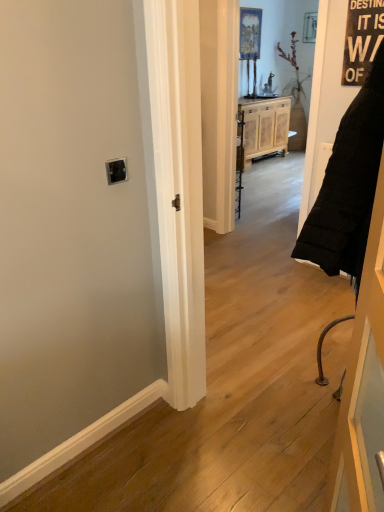
Question: Is black fabric door at right smaller than light brown wood cabinet at center?

Choices:
 (A) no
 (B) yes

Answer: (B)

Question: From a real-world perspective, is black fabric door at right located higher than light brown wood cabinet at center?

Choices:
 (A) yes
 (B) no

Answer: (A)

Question: Is light brown wood cabinet at center at the back of black fabric door at right?

Choices:
 (A) no
 (B) yes

Answer: (A)

Question: Is light brown wood cabinet at center inside black fabric door at right?

Choices:
 (A) yes
 (B) no

Answer: (B)

Question: Does black fabric door at right appear on the left side of light brown wood cabinet at center?

Choices:
 (A) no
 (B) yes

Answer: (B)

Question: Are black fabric door at right and light brown wood cabinet at center far apart?

Choices:
 (A) no
 (B) yes

Answer: (B)

Question: Does light brown wood cabinet at center come behind black fabric door at right?

Choices:
 (A) no
 (B) yes

Answer: (B)

Question: Does light brown wood cabinet at center have a lesser height compared to black fabric door at right?

Choices:
 (A) yes
 (B) no

Answer: (A)

Question: Could you tell me if light brown wood cabinet at center is facing black fabric door at right?

Choices:
 (A) no
 (B) yes

Answer: (B)

Question: Is light brown wood cabinet at center positioned far away from black fabric door at right?

Choices:
 (A) no
 (B) yes

Answer: (B)

Question: Does light brown wood cabinet at center have a lesser width compared to black fabric door at right?

Choices:
 (A) yes
 (B) no

Answer: (B)

Question: From a real-world perspective, is light brown wood cabinet at center on black fabric door at right?

Choices:
 (A) yes
 (B) no

Answer: (B)

Question: Choose the correct answer: Is black fabric door at right inside light brown wood cabinet at center or outside it?

Choices:
 (A) inside
 (B) outside

Answer: (B)